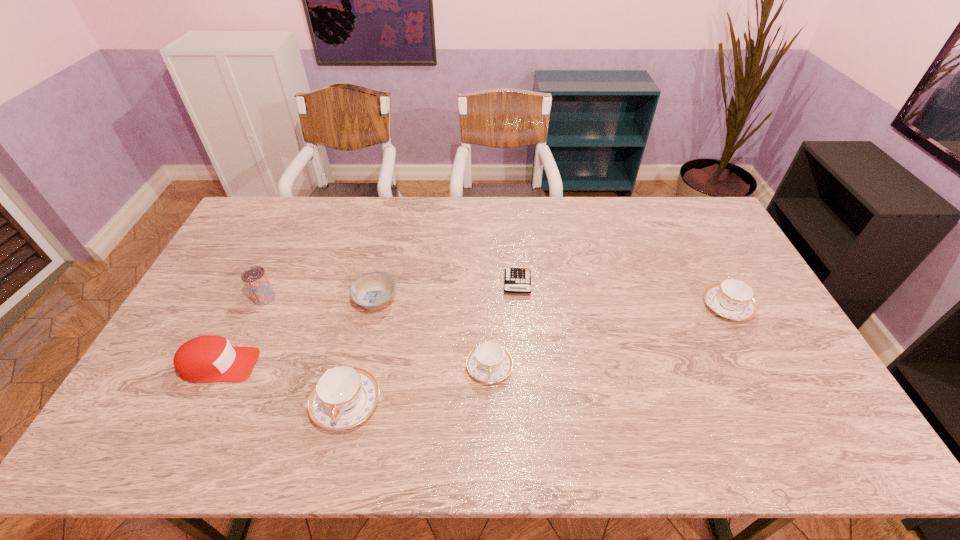
Identify the location of free spot between the calculator and the shortest teacup. The image size is (960, 540). (503, 326).

Identify the location of free space between the beer can and the farthest teacup. This screenshot has width=960, height=540. (495, 302).

This screenshot has width=960, height=540. I want to click on vacant space in between the beer can and the rightmost object, so click(495, 302).

Find the location of a particular element. free space between the bowl and the rightmost teacup is located at coordinates (552, 304).

Find the location of a particular element. The width and height of the screenshot is (960, 540). object that can be found as the fourth closest to the baseball cap is located at coordinates (489, 362).

Locate an element on the screen. the second closest object to the calculator is located at coordinates (372, 291).

Point out which teacup is positioned as the second nearest to the rightmost object. Please provide its 2D coordinates. Your answer should be formatted as a tuple, i.e. [(x, y)], where the tuple contains the x and y coordinates of a point satisfying the conditions above.

[(343, 397)]

Locate which teacup is the closest to the shortest teacup. Please provide its 2D coordinates. Your answer should be formatted as a tuple, i.e. [(x, y)], where the tuple contains the x and y coordinates of a point satisfying the conditions above.

[(343, 397)]